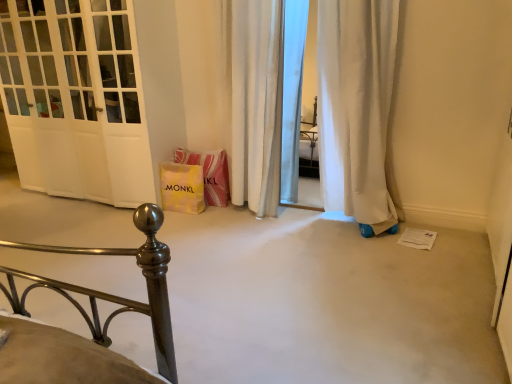
Where is `vacant area that is in front of white fabric curtain at center`? Image resolution: width=512 pixels, height=384 pixels. vacant area that is in front of white fabric curtain at center is located at coordinates (241, 235).